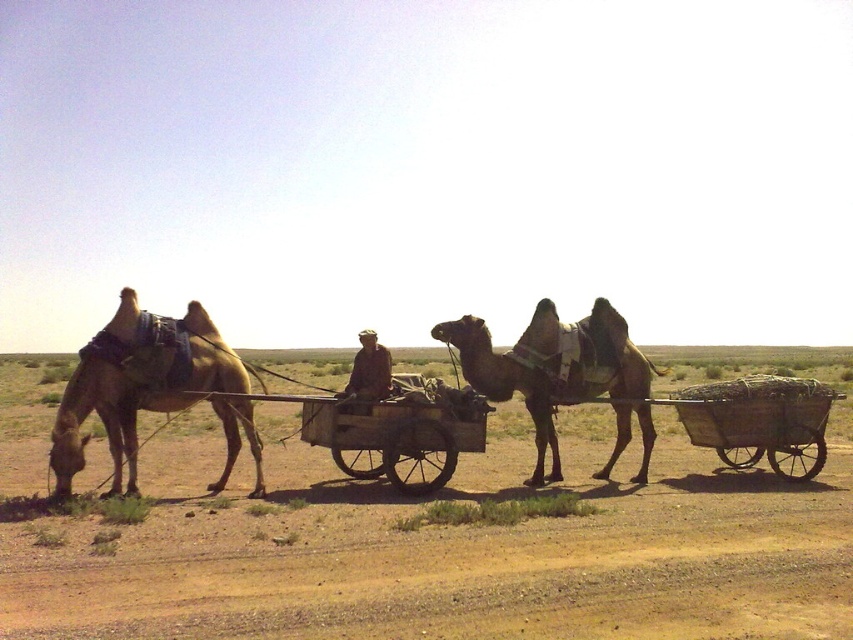
Question: Can you confirm if brown sandy dirt at center is positioned to the left of brown textured camel at center?

Choices:
 (A) yes
 (B) no

Answer: (B)

Question: Considering the real-world distances, which object is farthest from the wooden cart at center?

Choices:
 (A) brown textured camel at center
 (B) brown fabric hat at center
 (C) brown sandy dirt at center
 (D) brown textured camel at left

Answer: (C)

Question: Does brown textured camel at center appear on the right side of brown fabric hat at center?

Choices:
 (A) yes
 (B) no

Answer: (A)

Question: Which object is the closest to the brown fabric hat at center?

Choices:
 (A) brown textured camel at left
 (B) brown textured camel at center

Answer: (A)

Question: Which point is farther to the camera?

Choices:
 (A) brown fabric hat at center
 (B) wooden cart at center
 (C) brown sandy dirt at center
 (D) brown textured camel at left

Answer: (A)

Question: Is brown sandy dirt at center behind brown fabric hat at center?

Choices:
 (A) yes
 (B) no

Answer: (B)